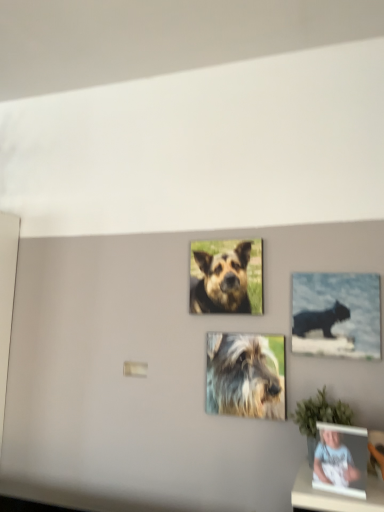
Question: From the image's perspective, would you say matte black photo frame at lower right is positioned over fuzzy fur dog at center, the 1th dog when ordered from bottom to top?

Choices:
 (A) yes
 (B) no

Answer: (B)

Question: Is matte black photo frame at lower right turned away from fuzzy fur dog at center, the second dog positioned from the top?

Choices:
 (A) yes
 (B) no

Answer: (B)

Question: Is matte black photo frame at lower right to the left of fuzzy fur dog at center, the second dog positioned from the top, from the viewer's perspective?

Choices:
 (A) yes
 (B) no

Answer: (B)

Question: Can you confirm if matte black photo frame at lower right is bigger than fuzzy fur dog at center, the second dog positioned from the top?

Choices:
 (A) yes
 (B) no

Answer: (B)

Question: Is matte black photo frame at lower right aimed at fuzzy fur dog at center, the second dog positioned from the top?

Choices:
 (A) no
 (B) yes

Answer: (A)

Question: From their relative heights in the image, would you say matte black photo frame at lower right is taller or shorter than brown fur dog at center, which is counted as the 1th dog, starting from the top?

Choices:
 (A) tall
 (B) short

Answer: (B)

Question: Is matte black photo frame at lower right bigger or smaller than brown fur dog at center, which is counted as the 1th dog, starting from the top?

Choices:
 (A) small
 (B) big

Answer: (A)

Question: Is point tap(316, 478) closer or farther from the camera than point tap(244, 242)?

Choices:
 (A) closer
 (B) farther

Answer: (A)

Question: In the image, is matte black photo frame at lower right positioned in front of or behind brown fur dog at center, which is counted as the 1th dog, starting from the top?

Choices:
 (A) front
 (B) behind

Answer: (A)

Question: Would you say brown fur dog at center, which is counted as the 1th dog, starting from the top, is inside or outside fuzzy fur dog at center, the second dog positioned from the top?

Choices:
 (A) outside
 (B) inside

Answer: (A)

Question: Considering the relative positions of brown fur dog at center, which is counted as the 1th dog, starting from the top, and fuzzy fur dog at center, the second dog positioned from the top, in the image provided, is brown fur dog at center, which is counted as the 1th dog, starting from the top, to the left or to the right of fuzzy fur dog at center, the second dog positioned from the top,?

Choices:
 (A) right
 (B) left

Answer: (B)

Question: From their relative heights in the image, would you say brown fur dog at center, which is counted as the 1th dog, starting from the top, is taller or shorter than fuzzy fur dog at center, the second dog positioned from the top?

Choices:
 (A) tall
 (B) short

Answer: (A)

Question: From the image's perspective, relative to fuzzy fur dog at center, the 1th dog when ordered from bottom to top, is brown fur dog at center, which is the second dog from bottom to top, above or below?

Choices:
 (A) above
 (B) below

Answer: (A)

Question: Is fuzzy fur dog at center, the second dog positioned from the top, spatially inside matte black photo frame at lower right, or outside of it?

Choices:
 (A) inside
 (B) outside

Answer: (B)

Question: From a real-world perspective, is fuzzy fur dog at center, the second dog positioned from the top, physically located above or below matte black photo frame at lower right?

Choices:
 (A) below
 (B) above

Answer: (B)